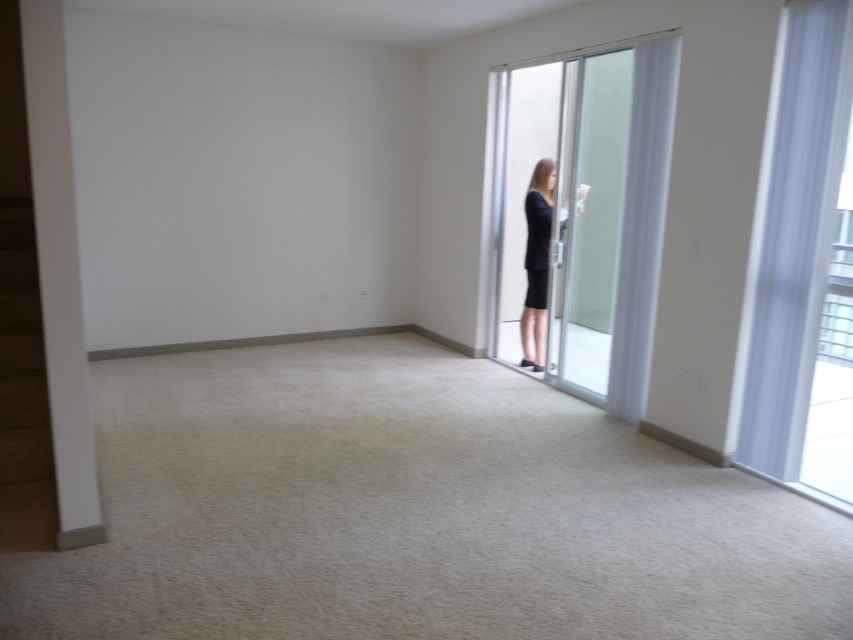
In the scene shown: You are standing in the room and want to walk to both the point at coordinates (793, 468) and the point at coordinates (546, 192). Which point should you reach first if you want to minimize your walking distance?

You should reach the point at coordinates (793, 468) first because it is closer to you than the point at coordinates (546, 192).

What is located at the point with coordinates (796,236) in the room?

The point at coordinates (796,236) indicates the location of a transparent fabric curtain at the right.

Looking at this image, you are organizing a photoshoot in the room described. The photoshoot requires that the black matte dress at center is positioned so that it is fully visible without being obscured by the transparent fabric curtain at right. Given their sizes, is this possible?

The transparent fabric curtain at right might be wider than black matte dress at center, so there is a possibility that the curtain could obscure the dress if positioned incorrectly. To ensure full visibility of the black matte dress at center, adjustments should be made to position the curtain appropriately or move the dress to a different location.